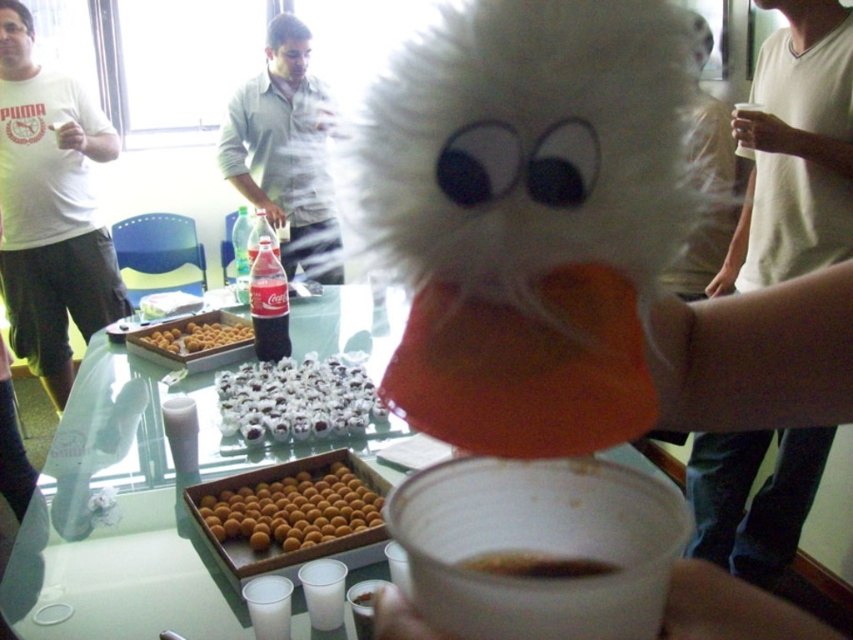
You are at a party and want to place a small plate on the transparent glass table at center and the white fluffy mask at upper center. Which object should you choose to place it on so that the plate won

The transparent glass table at center is positioned on the left side of white fluffy mask at upper center, so placing the plate on the transparent glass table at center would ensure it is closer to the mask and more visible.

You are at a party and want to place your white fluffy mask at upper center on the transparent glass table at center. Can you do so without the mask falling off the table?

The transparent glass table at center is not as tall as the white fluffy mask at upper center, so the mask might not fit properly on the table. Check the table dimensions before placing it.